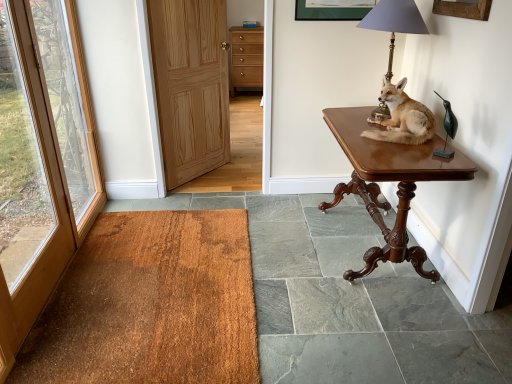
Question: From a real-world perspective, is brown fur taxidermy fox at upper right under light brown wood door at center, which appears as the 2th door when viewed from the left?

Choices:
 (A) yes
 (B) no

Answer: (B)

Question: Is the depth of brown fur taxidermy fox at upper right less than that of light brown wood door at center, the first door positioned from the right?

Choices:
 (A) no
 (B) yes

Answer: (B)

Question: Does brown fur taxidermy fox at upper right have a smaller size compared to light brown wood door at center, the first door positioned from the right?

Choices:
 (A) no
 (B) yes

Answer: (B)

Question: Is brown fur taxidermy fox at upper right facing away from light brown wood door at center, the first door positioned from the right?

Choices:
 (A) no
 (B) yes

Answer: (A)

Question: Is brown fur taxidermy fox at upper right to the right of light brown wood door at center, the first door positioned from the right, from the viewer's perspective?

Choices:
 (A) no
 (B) yes

Answer: (B)

Question: In terms of size, does light brown wood door at center, which appears as the 2th door when viewed from the left, appear bigger or smaller than brown fur taxidermy fox at upper right?

Choices:
 (A) big
 (B) small

Answer: (A)

Question: Does point (207, 107) appear closer or farther from the camera than point (391, 117)?

Choices:
 (A) farther
 (B) closer

Answer: (A)

Question: Is light brown wood door at center, which appears as the 2th door when viewed from the left, in front of or behind brown fur taxidermy fox at upper right in the image?

Choices:
 (A) front
 (B) behind

Answer: (B)

Question: Is light brown wood door at center, which appears as the 2th door when viewed from the left, situated inside brown fur taxidermy fox at upper right or outside?

Choices:
 (A) inside
 (B) outside

Answer: (B)

Question: Considering the positions of brown textured mat at lower left and brown wood table at right in the image, is brown textured mat at lower left wider or thinner than brown wood table at right?

Choices:
 (A) wide
 (B) thin

Answer: (A)

Question: From the image's perspective, relative to brown wood table at right, is brown textured mat at lower left above or below?

Choices:
 (A) above
 (B) below

Answer: (B)

Question: From a real-world perspective, is brown textured mat at lower left positioned above or below brown wood table at right?

Choices:
 (A) above
 (B) below

Answer: (B)

Question: In the image, is brown textured mat at lower left positioned in front of or behind brown wood table at right?

Choices:
 (A) behind
 (B) front

Answer: (B)

Question: From their relative heights in the image, would you say blue plastic corded phone at upper center is taller or shorter than brown wood door at left, the 2th door viewed from the right?

Choices:
 (A) tall
 (B) short

Answer: (B)

Question: From the image's perspective, is blue plastic corded phone at upper center located above or below brown wood door at left, which ranks as the first door in left-to-right order?

Choices:
 (A) below
 (B) above

Answer: (B)